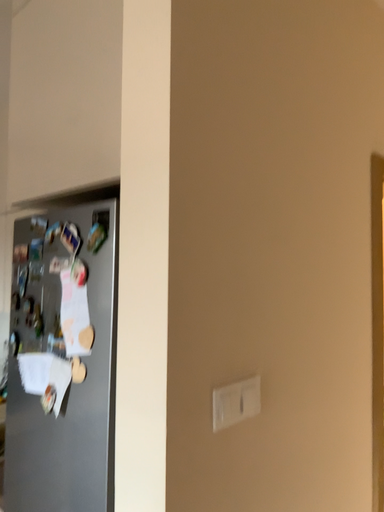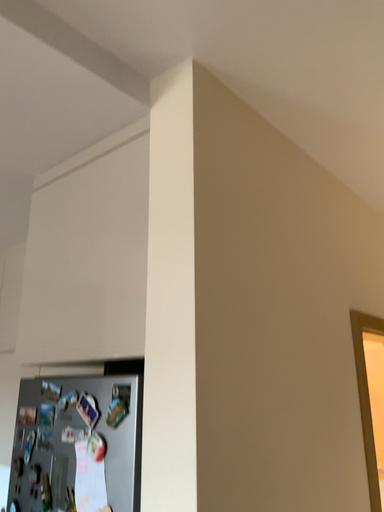
Question: How did the camera likely rotate when shooting the video?

Choices:
 (A) rotated downward
 (B) rotated upward

Answer: (B)